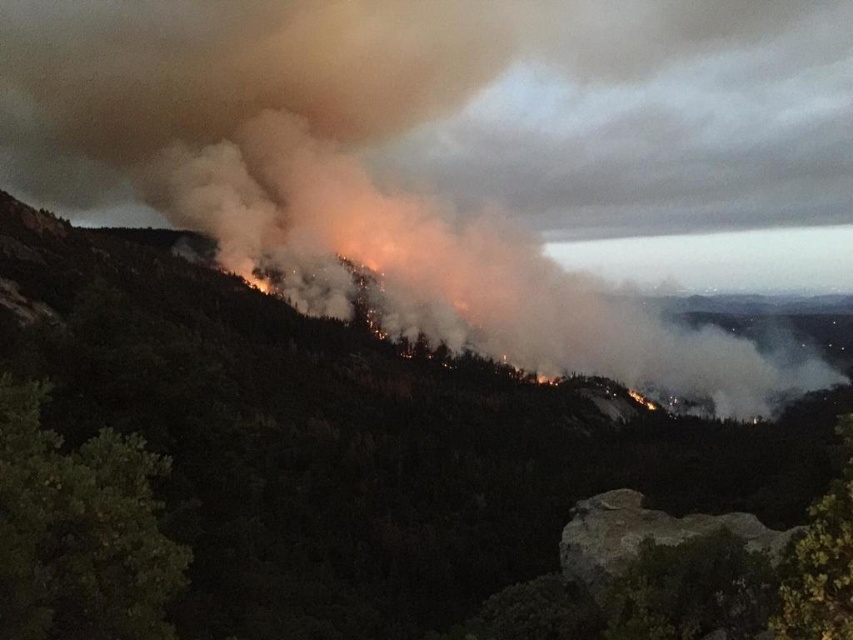
You are a firefighter trying to assess the fire spread. You notice two critical points in the image, point A at coordinates point (x=233, y=557) and point B at coordinates point (x=463, y=339). Which point is closer to you?

Point A at coordinates point (x=233, y=557) is closer to the viewer than point B at coordinates point (x=463, y=339).

You are a firefighter standing at the point marked as point (44, 218) in the image. You need to reach a safe zone that is 200 meters away from your current position. Can you safely reach the safe zone before the fire spreads further?

The distance between point (44, 218) and the viewer is 217.01 meters. Since the safe zone is 200 meters away from your current position, you are currently 17.01 meters beyond the safe zone distance. Therefore, you cannot safely reach the safe zone before the fire spreads further.